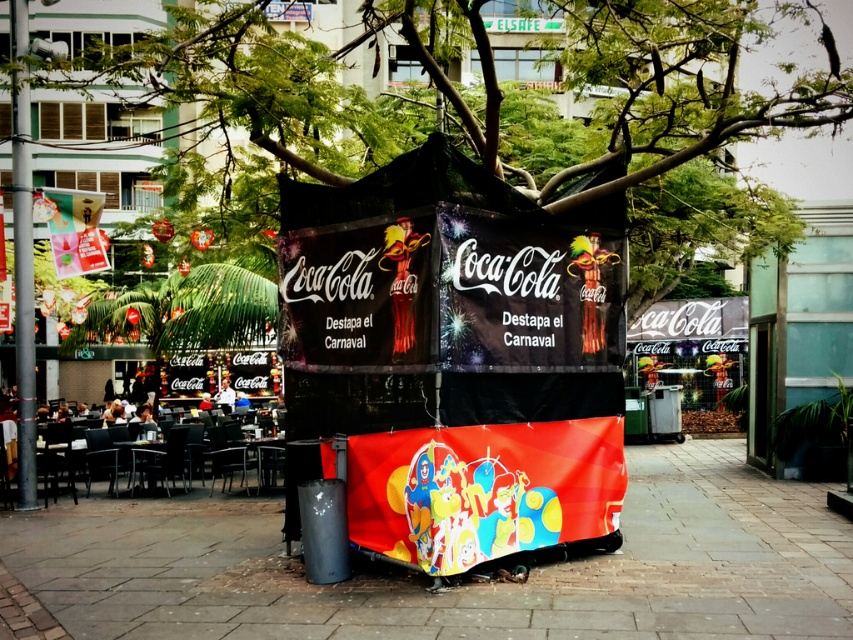
Can you confirm if brick pavement at center is positioned above black metal pole at left?

No.

Does brick pavement at center come in front of black metal pole at left?

Yes, brick pavement at center is in front of black metal pole at left.

What do you see at coordinates (462, 584) in the screenshot? I see `brick pavement at center` at bounding box center [462, 584].

You are a GUI agent. You are given a task and a screenshot of the screen. Output one action in this format:
    pyautogui.click(x=<x>, y=<y>)
    Task: Click on the brick pavement at center
    The width and height of the screenshot is (853, 640).
    Given the screenshot: What is the action you would take?
    tap(462, 584)